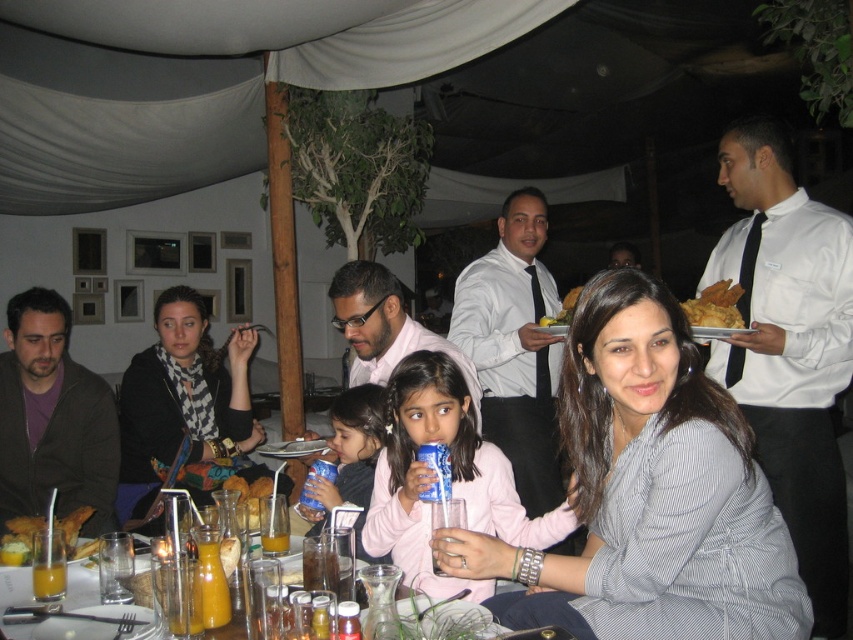
You are a waiter in a restaurant and you see the gray striped shirt at center. Where should you place the customer order on the table?

The gray striped shirt at center is located at point (648, 493), so you should place the customer order near that position.

You are a waiter at the restaurant and need to place a new order of drinks on the table. The customer has requested that the drinks be placed as far away as possible from the white satin shirt at right. Where should you place the drinks on the table?

The white satin shirt at right is located at point (788,348). To place the drinks as far away as possible from this position, position them near the opposite corner of the table, which would be the lower left area since the shirt is at the upper right.